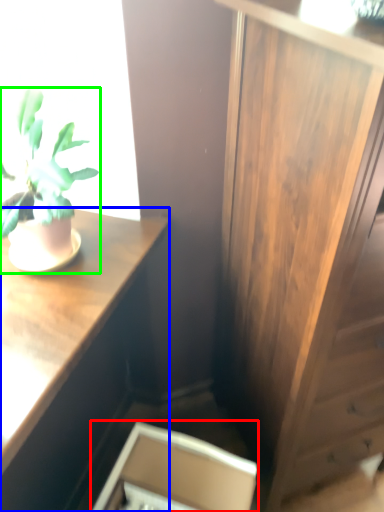
Question: Estimate the real-world distances between objects in this image. Which object is farther from cabinetry (highlighted by a red box), desk (highlighted by a blue box) or houseplant (highlighted by a green box)?

Choices:
 (A) desk
 (B) houseplant

Answer: (B)